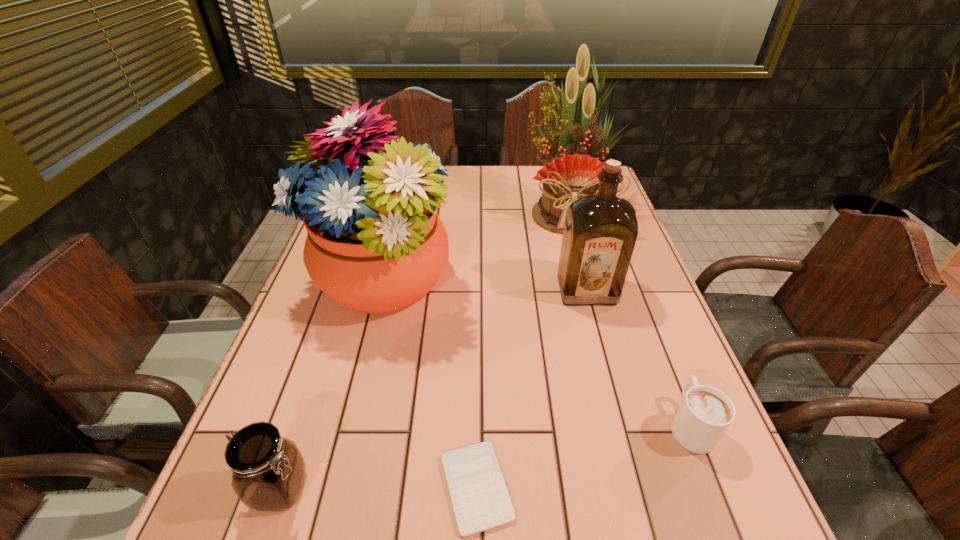
This screenshot has height=540, width=960. In order to click on vacant space located on the side with the handle of the cappuccino in this screenshot , I will do `click(645, 310)`.

The width and height of the screenshot is (960, 540). I want to click on blank area located 0.280m on the side with the handle of the cappuccino, so click(640, 299).

Where is `blank space located 0.350m on the side with the handle of the cappuccino`? The width and height of the screenshot is (960, 540). blank space located 0.350m on the side with the handle of the cappuccino is located at coordinates (633, 280).

The width and height of the screenshot is (960, 540). What are the coordinates of `vacant space situated 0.160m on the back of the shortest object` in the screenshot? It's located at (477, 372).

Locate an element on the screen. object that is at the far edge is located at coordinates (572, 173).

What are the coordinates of `object present at the near edge` in the screenshot? It's located at (480, 499).

This screenshot has width=960, height=540. I want to click on flower arrangement that is at the left edge, so click(x=375, y=244).

Locate an element on the screen. This screenshot has height=540, width=960. jar that is at the left edge is located at coordinates (268, 471).

You are a GUI agent. You are given a task and a screenshot of the screen. Output one action in this format:
    pyautogui.click(x=<x>, y=<y>)
    Task: Click on the flower arrangement that is at the right edge
    
    Given the screenshot: What is the action you would take?
    (x=572, y=173)

This screenshot has width=960, height=540. I want to click on liquor that is at the right edge, so click(600, 231).